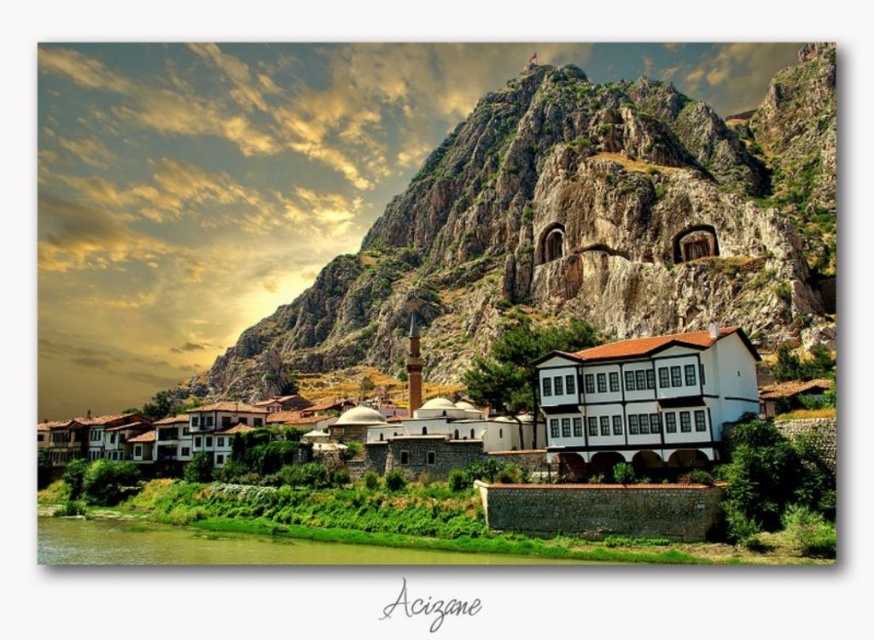
Can you confirm if rugged stone mountain at upper center is wider than white stone building at center?

Yes, rugged stone mountain at upper center is wider than white stone building at center.

Which is behind, point (637, 205) or point (470, 448)?

Point (637, 205)

Identify the location of rugged stone mountain at upper center. (574, 228).